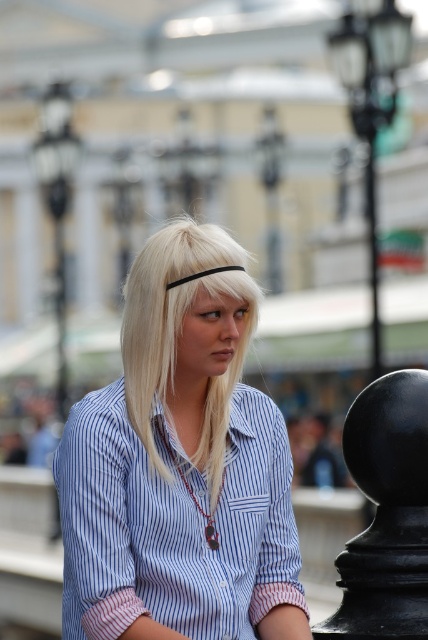
You are a photographer trying to capture the person in the image. If you want to focus on the blonde hair at center and the blue striped shirt at center, which one should you adjust your camera to focus on first based on their positions?

The blue striped shirt at center is to the right of the blonde hair at center. Since the camera focus typically starts from the closest object, you should first focus on the blonde hair at center before adjusting to the blue striped shirt at center.

You are taking a photo of the scene and want to focus on both the point at coordinates point(92, 609) and point(219, 385). Given that your camera can only focus on one depth plane, which point should you focus on to ensure at least one of them is in focus?

You should focus on point(92, 609) because it is closer to the camera than point(219, 385), so focusing on it will ensure that at least the closer point is in focus.

You are a fashion designer analyzing the image. You need to determine which of the two items, the blue striped shirt at center or the blonde hair at center, has a greater width in the image. Based on the description, which one is wider?

The blue striped shirt at center has a greater width than the blonde hair at center according to the description.